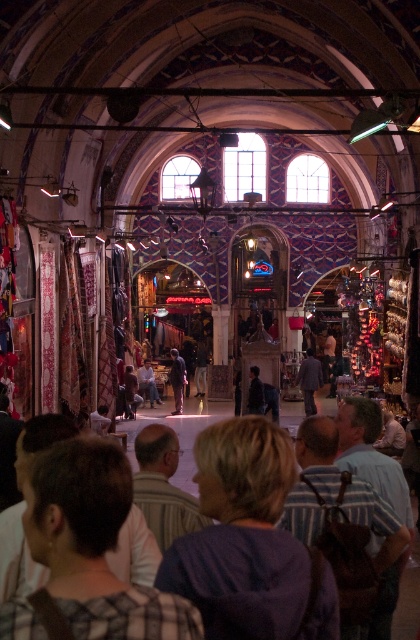
You are a customer in the market and want to buy a fabric item. You see the purple fabric at center and the plaid fabric shirt at lower center. Which item has a greater width?

The purple fabric at center has a greater width than the plaid fabric shirt at lower center.

You are standing in the market and see a point marked at coordinates [241,536]. According to the scene description, which object is this point located on?

The point at [241,536] is located on the purple fabric at center.